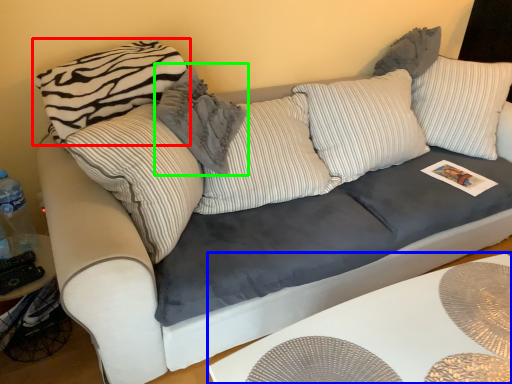
Question: Which object is the farthest from pillow (highlighted by a red box)? Choose among these: table (highlighted by a blue box) or pillow (highlighted by a green box).

Choices:
 (A) table
 (B) pillow

Answer: (A)